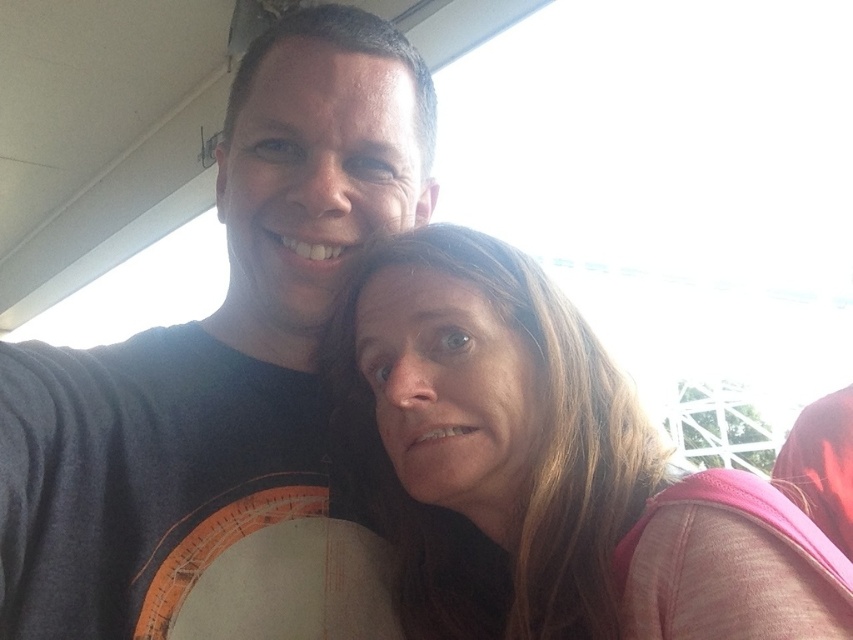
Does dark gray t-shirt at upper left come in front of pink fabric at center?

No, it is not.

Is dark gray t-shirt at upper left below pink fabric at center?

Incorrect, dark gray t-shirt at upper left is not positioned below pink fabric at center.

Where is `dark gray t-shirt at upper left`? The height and width of the screenshot is (640, 853). dark gray t-shirt at upper left is located at coordinates (224, 380).

Where is `dark gray t-shirt at upper left`? This screenshot has width=853, height=640. dark gray t-shirt at upper left is located at coordinates (224, 380).